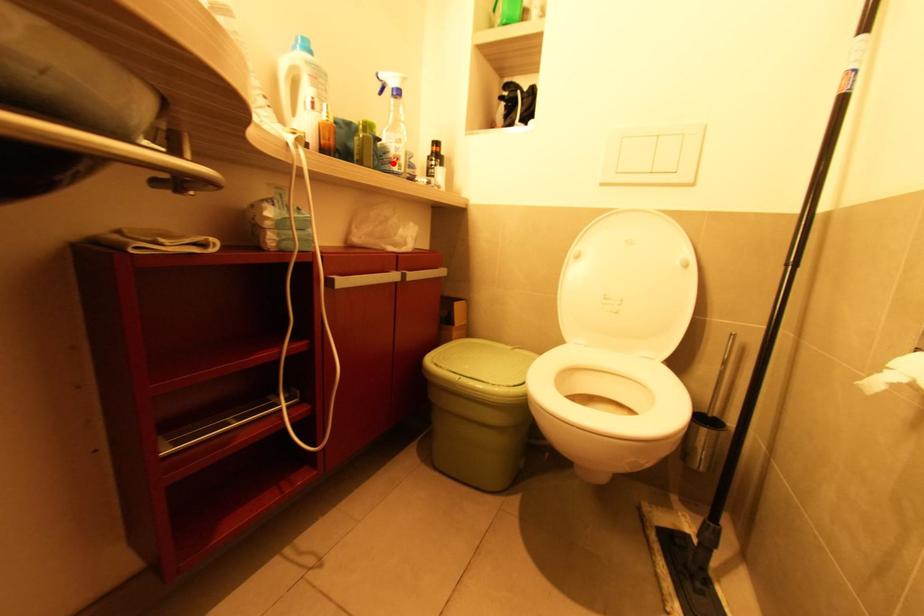
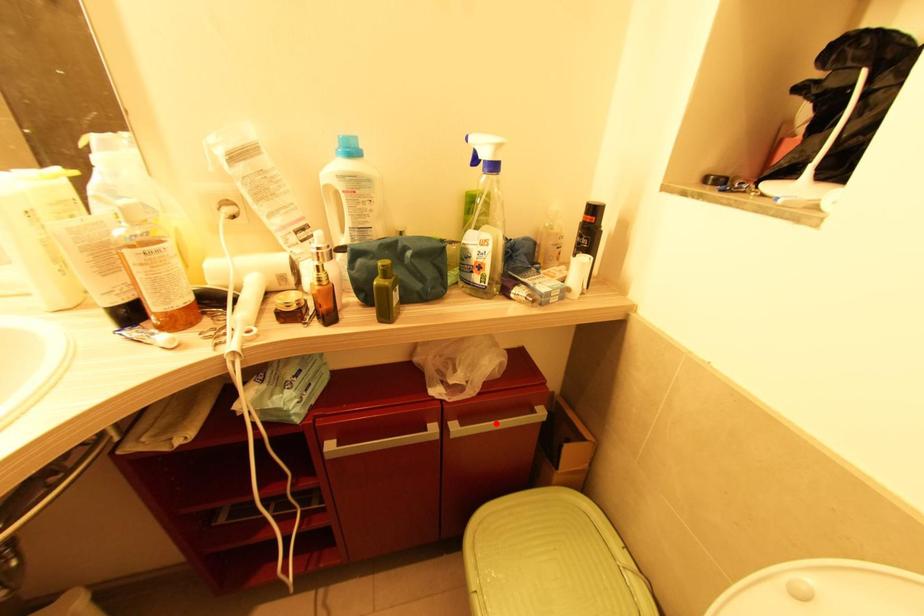
I am providing you with two images of the same scene from different viewpoints. A red point is marked on the first image and another point is marked on the second image. Is the red point in image1 aligned with the point shown in image2?

No